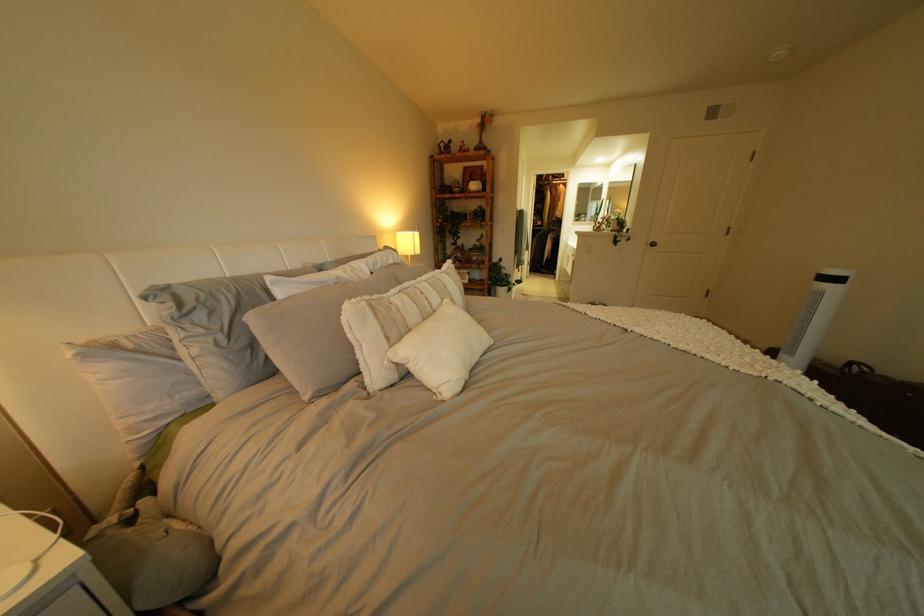
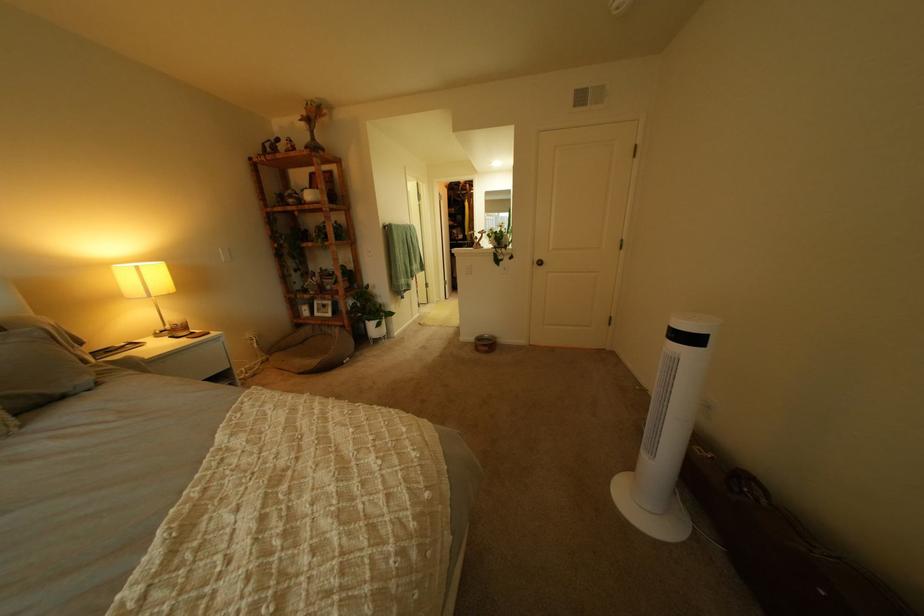
Locate, in the second image, the point that corresponds to pixel 854 281 in the first image.

(710, 341)